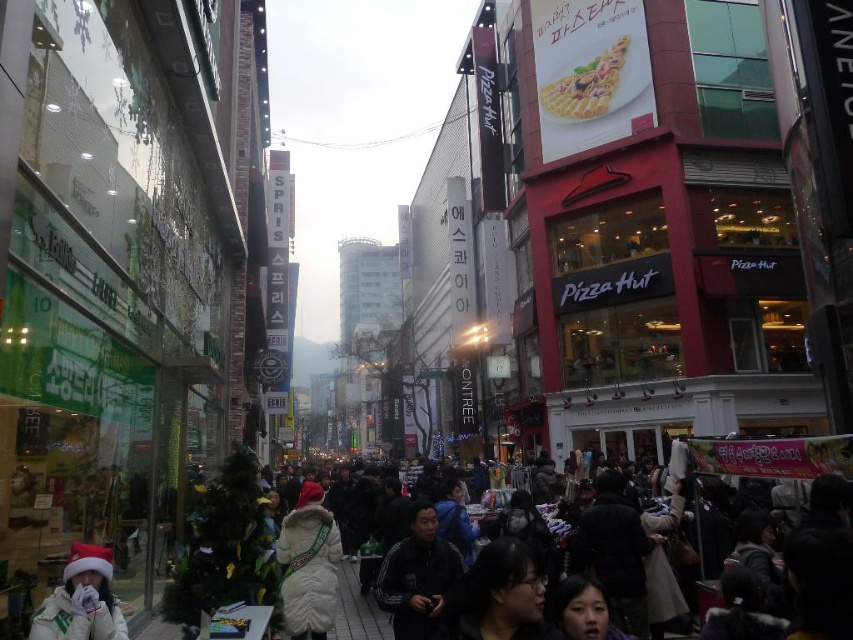
Where is `dark gray jacket at center`? The image size is (853, 640). dark gray jacket at center is located at coordinates (416, 576).

From the picture: Is dark gray jacket at center taller than white fleece jacket at lower left?

Correct, dark gray jacket at center is much taller as white fleece jacket at lower left.

What do you see at coordinates (416, 576) in the screenshot?
I see `dark gray jacket at center` at bounding box center [416, 576].

I want to click on dark gray jacket at center, so [x=416, y=576].

Does white fur coat at center have a greater height compared to dark gray jacket at center?

Correct, white fur coat at center is much taller as dark gray jacket at center.

Describe the element at coordinates (308, 564) in the screenshot. I see `white fur coat at center` at that location.

In the scene shown: Who is more distant from viewer, [289,611] or [393,624]?

The point [289,611] is more distant.

You are a GUI agent. You are given a task and a screenshot of the screen. Output one action in this format:
    pyautogui.click(x=<x>, y=<y>)
    Task: Click on the white fur coat at center
    The height and width of the screenshot is (640, 853).
    Given the screenshot: What is the action you would take?
    (308, 564)

Can you confirm if matte black glasses at lower center is wider than white fleece jacket at lower left?

Yes.

Measure the distance between point (x=521, y=616) and camera.

10.96 feet

Identify the location of matte black glasses at lower center. The image size is (853, 640). (497, 596).